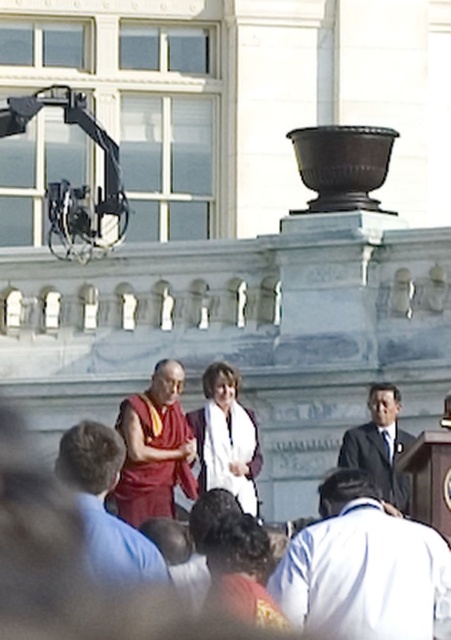
You are a photographer trying to capture a photo of both the maroon silk robe at center and the white cotton robe at center. Which robe should you focus on first to ensure it appears larger in the photo?

The maroon silk robe at center is much taller than the white cotton robe at center, so you should focus on the maroon silk robe at center first to ensure it appears larger in the photo.

You are a photographer standing 5 meters away from the maroon silk robe at center and dark suit at center. Can you fit both of them in your camera frame if your camera has a maximum field of view that can capture objects up to 6 meters apart?

The maroon silk robe at center and dark suit at center are 6.24 meters apart from each other. Since the camera can only capture up to 6 meters, the distance between them exceeds the camera field of view. Therefore, both cannot be fully captured in a single frame.

What are the coordinates of the maroon silk robe at center?

The maroon silk robe at center is located at coordinates point (155, 448).